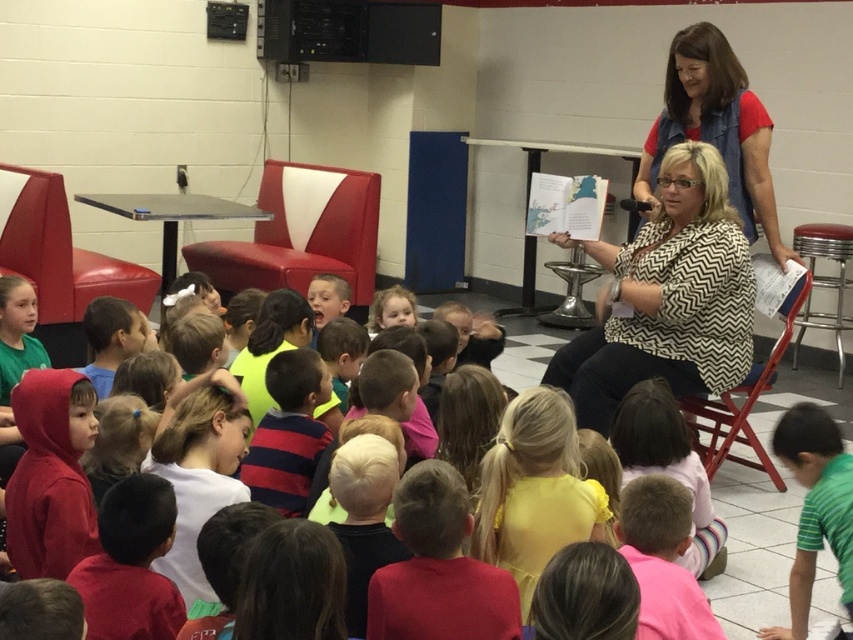
Question: Is black and white zigzag shirt at center further to the viewer compared to chevron-patterned blouse at center?

Choices:
 (A) no
 (B) yes

Answer: (A)

Question: Where is black and white zigzag shirt at center located in relation to metallic silver stool at right in the image?

Choices:
 (A) left
 (B) right

Answer: (A)

Question: Can you confirm if green striped shirt at lower right is thinner than metallic silver stool at right?

Choices:
 (A) yes
 (B) no

Answer: (A)

Question: Estimate the real-world distances between objects in this image. Which object is closer to the red leather chair at center?

Choices:
 (A) chevron-patterned blouse at center
 (B) green striped shirt at lower right

Answer: (A)

Question: Based on their relative distances, which object is farther from the black and white zigzag shirt at center?

Choices:
 (A) chevron-patterned blouse at center
 (B) red leather chair at center

Answer: (B)

Question: Which point appears closest to the camera in this image?

Choices:
 (A) (781, 419)
 (B) (584, 387)

Answer: (A)